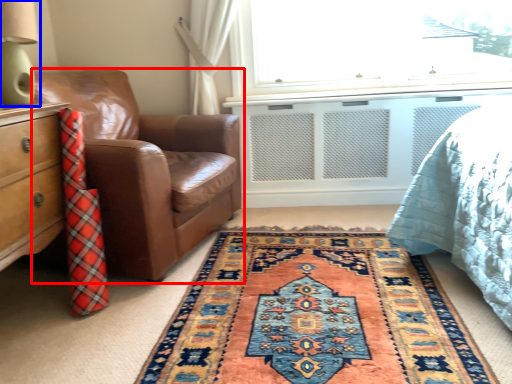
Question: Which object is further to the camera taking this photo, chair (highlighted by a red box) or table lamp (highlighted by a blue box)?

Choices:
 (A) chair
 (B) table lamp

Answer: (A)